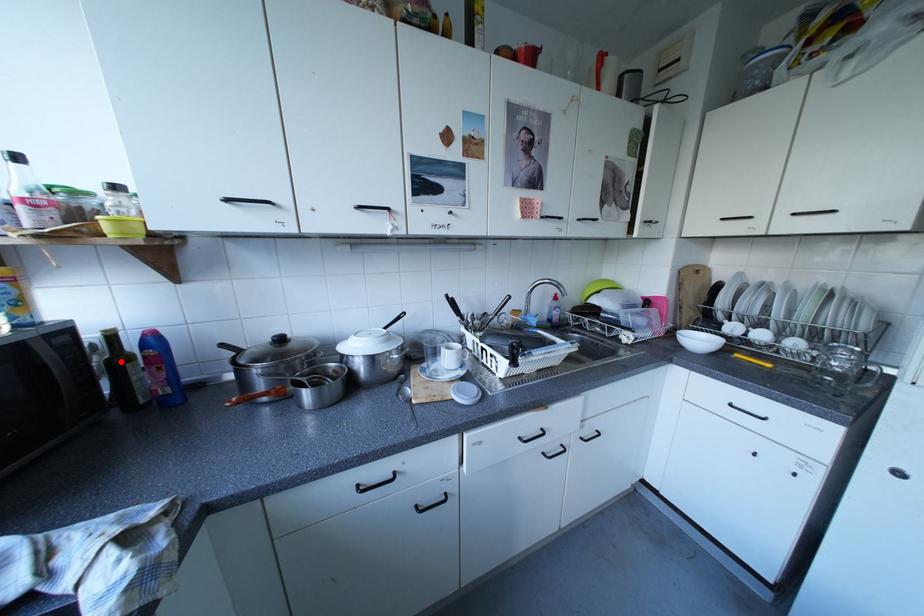
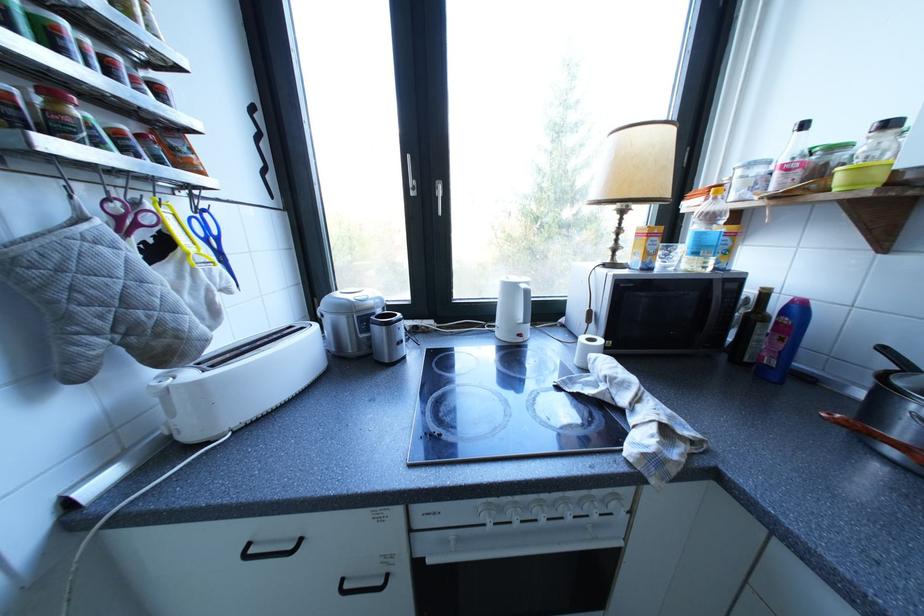
Locate, in the second image, the point that corresponds to the highlighted location in the first image.

(760, 315)